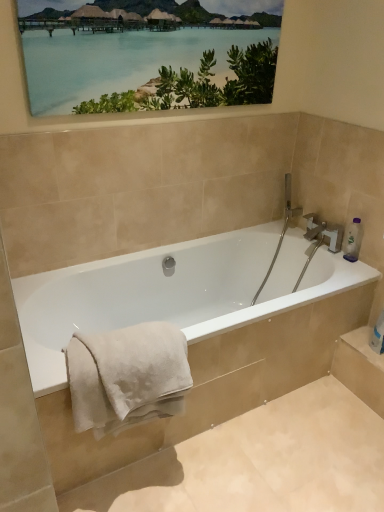
Question: Looking at the image, does matte wooden picture frame at upper center seem bigger or smaller compared to clear plastic bottle at upper right?

Choices:
 (A) big
 (B) small

Answer: (A)

Question: In terms of height, does matte wooden picture frame at upper center look taller or shorter compared to clear plastic bottle at upper right?

Choices:
 (A) tall
 (B) short

Answer: (A)

Question: Which object is the closest to the white glossy bathtub at center?

Choices:
 (A) matte wooden picture frame at upper center
 (B) clear plastic bottle at upper right
 (C) white soft towel at lower left

Answer: (C)

Question: Which is nearer to the clear plastic bottle at upper right?

Choices:
 (A) white soft towel at lower left
 (B) white glossy bathtub at center
 (C) matte wooden picture frame at upper center

Answer: (B)